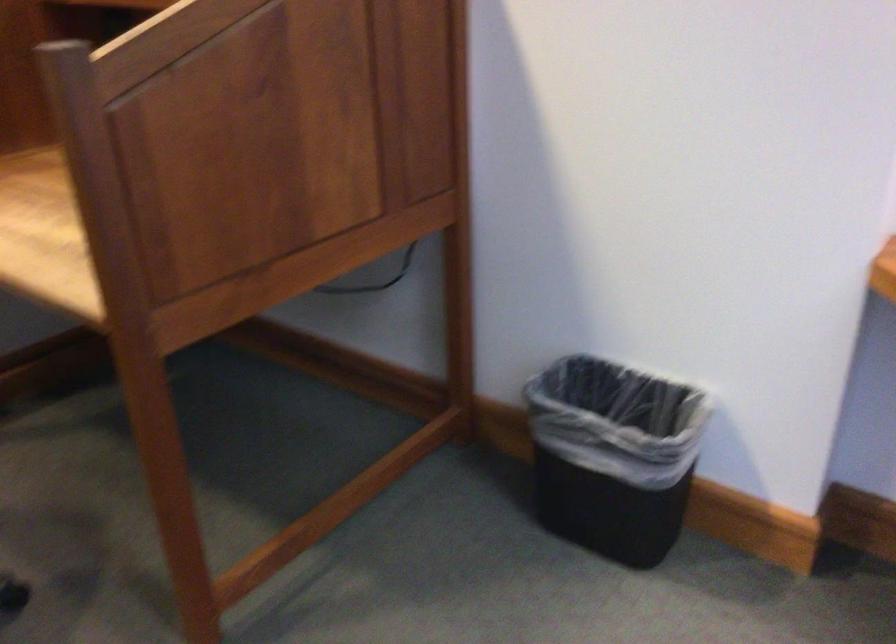
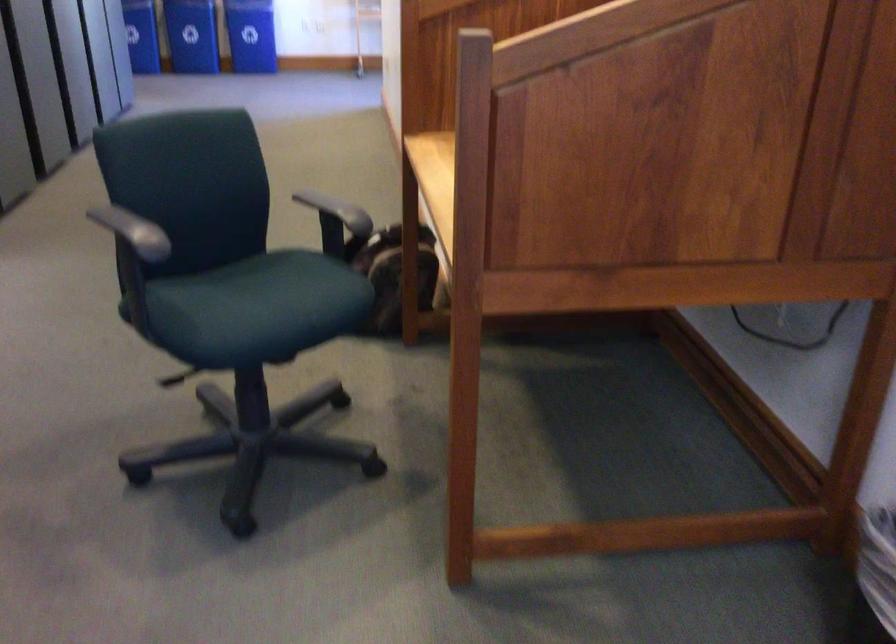
Question: The camera is either moving clockwise (left) or counter-clockwise (right) around the object. The first image is from the beginning of the video and the second image is from the end. Is the camera moving left or right when shooting the video?

Choices:
 (A) Left
 (B) Right

Answer: (B)